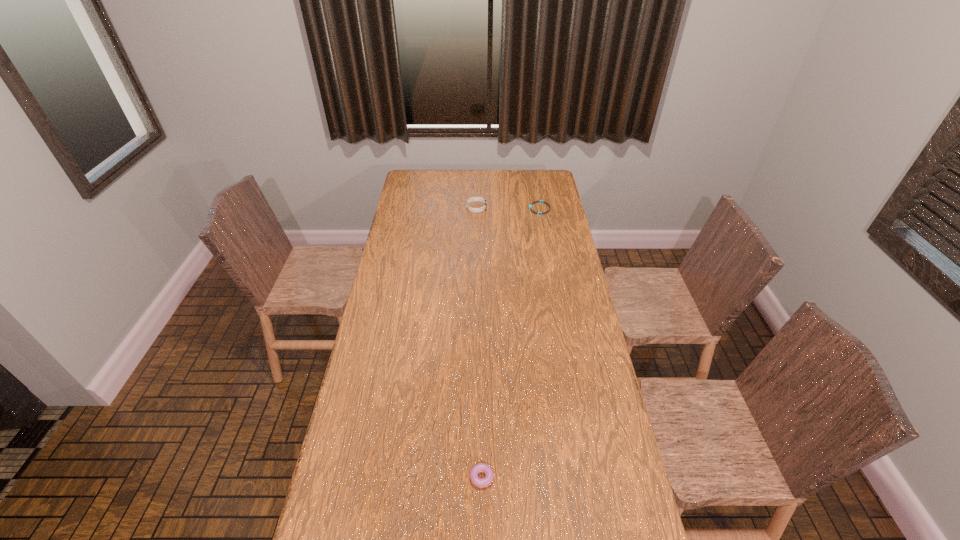
Locate an element on the screen. The image size is (960, 540). vacant space that satisfies the following two spatial constraints: 1. on the buckle of the shortest object; 2. on the front side of the second tallest object is located at coordinates point(588,475).

Where is `vacant space that satisfies the following two spatial constraints: 1. on the outer surface of the left wristband; 2. on the left side of the doughnut`? vacant space that satisfies the following two spatial constraints: 1. on the outer surface of the left wristband; 2. on the left side of the doughnut is located at coordinates (473, 475).

I want to click on free space that satisfies the following two spatial constraints: 1. on the outer surface of the second tallest object; 2. on the left side of the taller wristband, so click(x=473, y=475).

Find the location of a particular element. Image resolution: width=960 pixels, height=540 pixels. free location that satisfies the following two spatial constraints: 1. on the outer surface of the taller wristband; 2. on the left side of the second tallest object is located at coordinates (473, 475).

Where is `free location that satisfies the following two spatial constraints: 1. on the buckle of the shortest object; 2. on the front side of the doughnut`? free location that satisfies the following two spatial constraints: 1. on the buckle of the shortest object; 2. on the front side of the doughnut is located at coordinates (588, 475).

Where is `blank area in the image that satisfies the following two spatial constraints: 1. on the outer surface of the tallest object; 2. on the left side of the nearest object`? The height and width of the screenshot is (540, 960). blank area in the image that satisfies the following two spatial constraints: 1. on the outer surface of the tallest object; 2. on the left side of the nearest object is located at coordinates coord(473,475).

Find the location of `free point that satisfies the following two spatial constraints: 1. on the outer surface of the second shortest object; 2. on the left side of the tallest object`. free point that satisfies the following two spatial constraints: 1. on the outer surface of the second shortest object; 2. on the left side of the tallest object is located at coordinates (473, 475).